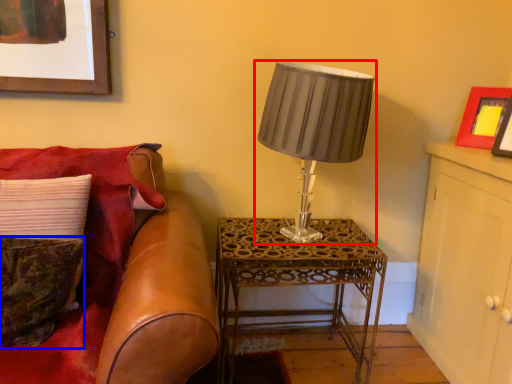
Question: Which of the following is the farthest to the observer, lamp (highlighted by a red box) or pillow (highlighted by a blue box)?

Choices:
 (A) lamp
 (B) pillow

Answer: (A)